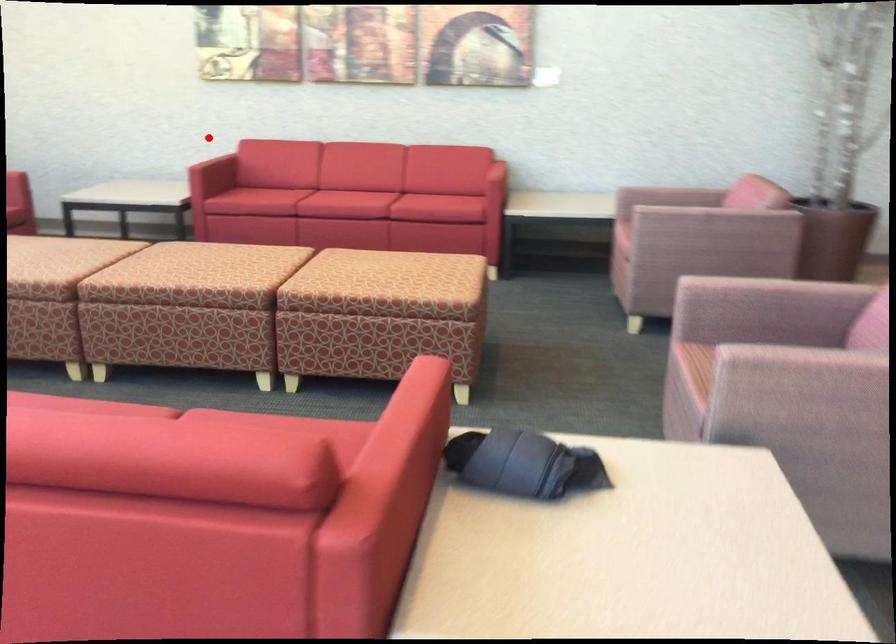
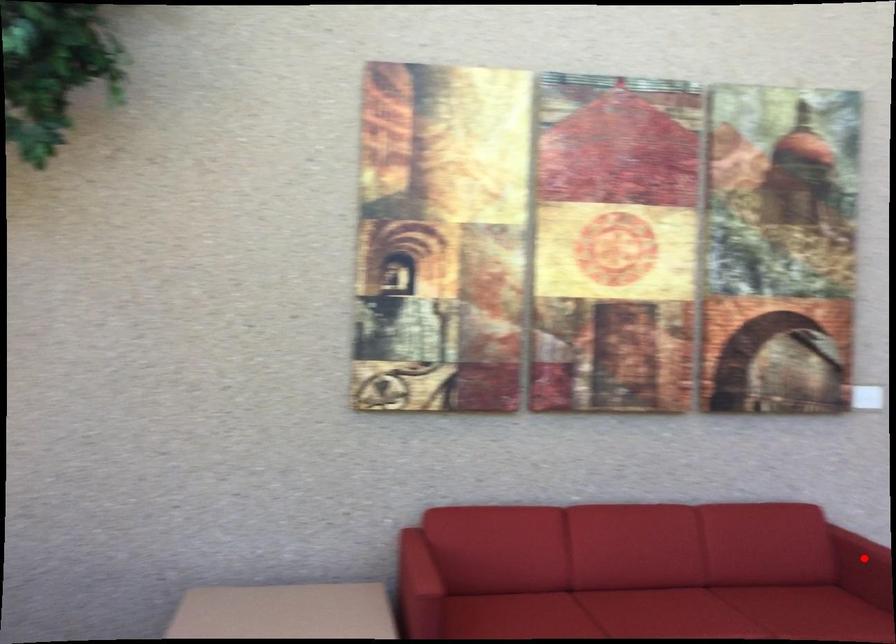
Based on the photo, I am providing you with two images of the same scene from different viewpoints. A red point is marked on the first image and another point is marked on the second image. Is the red point in image1 aligned with the point shown in image2?

Result: No